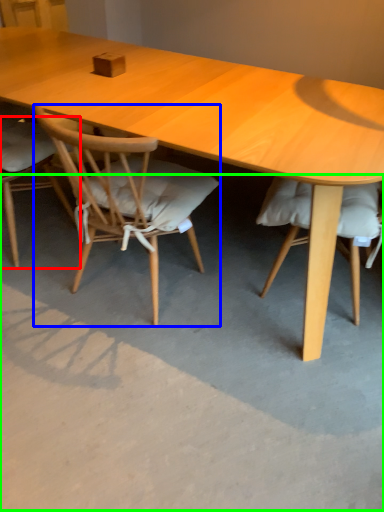
Question: Considering the real-world distances, which object is closest to chair (highlighted by a red box)? chair (highlighted by a blue box) or concrete (highlighted by a green box).

Choices:
 (A) chair
 (B) concrete

Answer: (A)